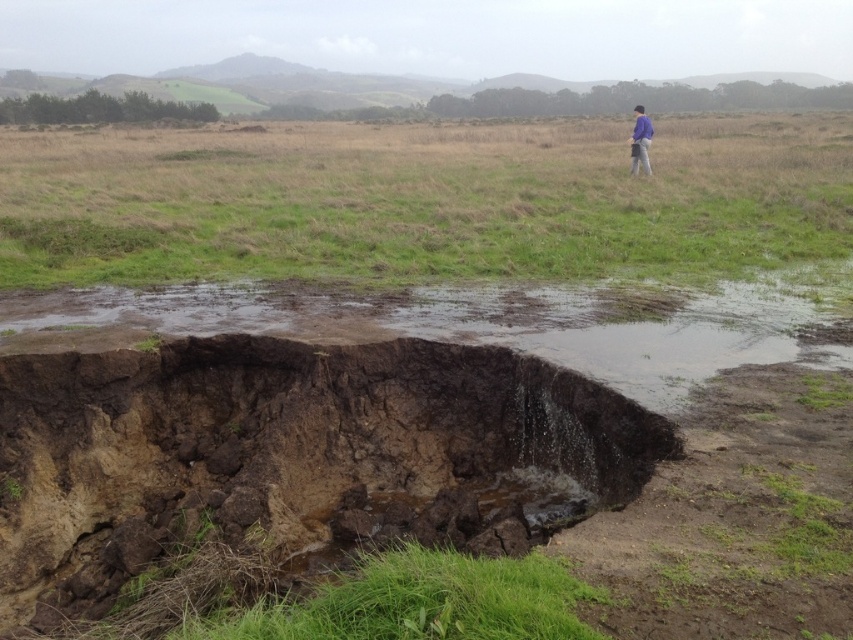
Question: Does brown muddy water at center appear on the right side of purple fabric jacket at upper right?

Choices:
 (A) yes
 (B) no

Answer: (B)

Question: Estimate the real-world distances between objects in this image. Which object is closer to the brown muddy hole at center?

Choices:
 (A) purple fabric jacket at upper right
 (B) green grass at upper center

Answer: (B)

Question: Which of the following is the closest to the observer?

Choices:
 (A) green grass at upper center
 (B) purple fabric jacket at upper right
 (C) brown muddy hole at center

Answer: (C)

Question: Does brown muddy hole at center have a lesser width compared to brown muddy water at center?

Choices:
 (A) no
 (B) yes

Answer: (A)

Question: Can you confirm if brown muddy water at center is positioned below purple fabric jacket at upper right?

Choices:
 (A) yes
 (B) no

Answer: (A)

Question: Among these points, which one is nearest to the camera?

Choices:
 (A) (592, 336)
 (B) (648, 125)
 (C) (390, 365)
 (D) (680, 131)

Answer: (C)